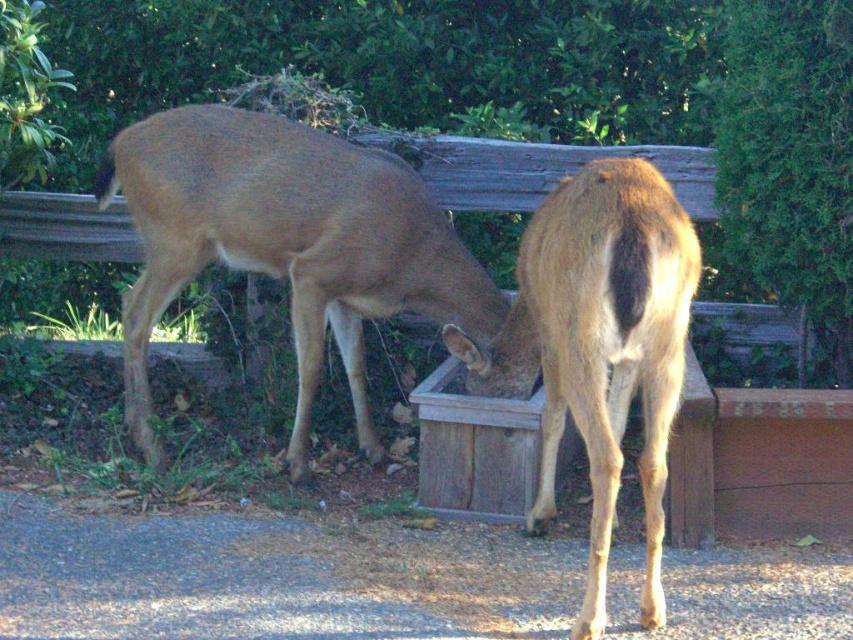
Does brown matte deer at center appear on the left side of brown fur deer at right?

Indeed, brown matte deer at center is positioned on the left side of brown fur deer at right.

Does point (167, 131) come in front of point (474, 388)?

That is False.

The height and width of the screenshot is (640, 853). Identify the location of brown matte deer at center. (285, 243).